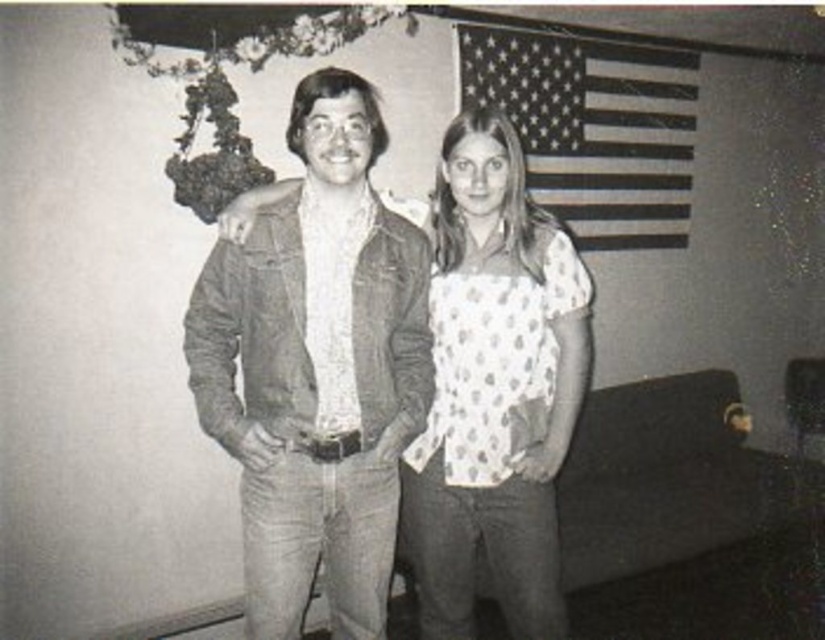
Is denim jacket at center smaller than white dotted blouse at center?

Incorrect, denim jacket at center is not smaller in size than white dotted blouse at center.

Is denim jacket at center wider than white dotted blouse at center?

Indeed, denim jacket at center has a greater width compared to white dotted blouse at center.

Identify the location of denim jacket at center. The height and width of the screenshot is (640, 825). (317, 369).

At what (x,y) coordinates should I click in order to perform the action: click on denim jacket at center. Please return your answer as a coordinate pair (x, y). This screenshot has height=640, width=825. Looking at the image, I should click on (317, 369).